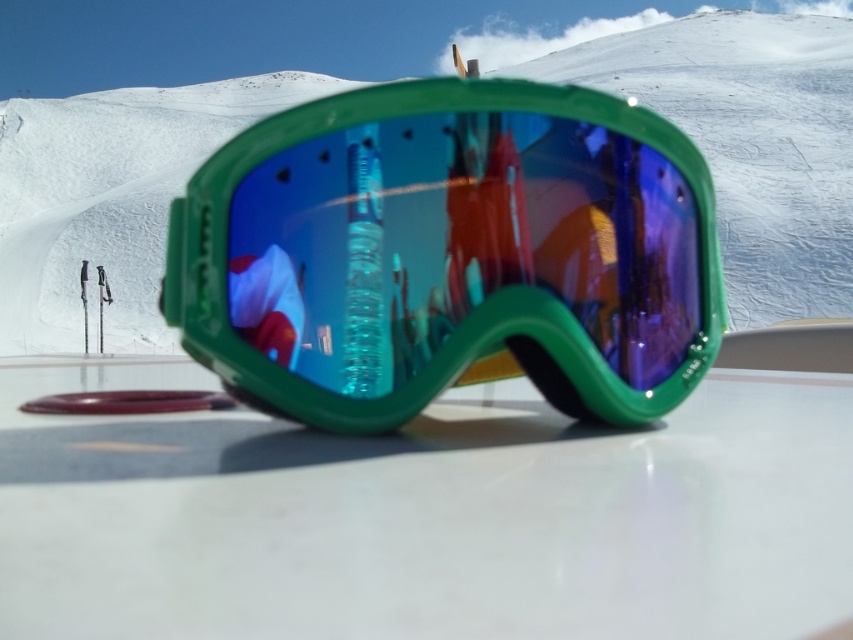
Is white glossy table at center shorter than green plastic goggles at center?

Correct, white glossy table at center is not as tall as green plastic goggles at center.

This screenshot has height=640, width=853. What do you see at coordinates (425, 515) in the screenshot? I see `white glossy table at center` at bounding box center [425, 515].

At what (x,y) coordinates should I click in order to perform the action: click on white glossy table at center. Please return your answer as a coordinate pair (x, y). This screenshot has width=853, height=640. Looking at the image, I should click on (425, 515).

Can you confirm if green plastic goggles at center is smaller than white matte snow at center?

Yes, green plastic goggles at center is smaller than white matte snow at center.

What do you see at coordinates (450, 253) in the screenshot? The height and width of the screenshot is (640, 853). I see `green plastic goggles at center` at bounding box center [450, 253].

Is point (183, 276) closer to camera compared to point (47, 307)?

Yes, it is.

This screenshot has width=853, height=640. Identify the location of green plastic goggles at center. (450, 253).

Can you confirm if white glossy table at center is wider than white matte snow at center?

Incorrect, white glossy table at center's width does not surpass white matte snow at center's.

Is point (801, 481) closer to viewer compared to point (675, 97)?

Yes, point (801, 481) is closer to viewer.

Where is `white glossy table at center`? This screenshot has height=640, width=853. white glossy table at center is located at coordinates (425, 515).